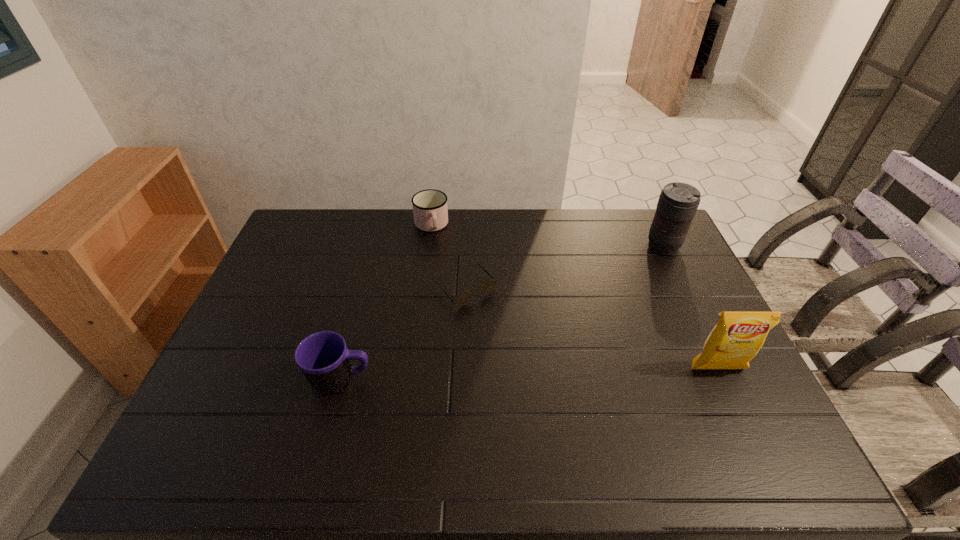
Find the location of a particular element. the left mug is located at coordinates (323, 357).

The image size is (960, 540). What are the coordinates of `the third shortest object` in the screenshot? It's located at coord(323,357).

Identify the location of crisp (potato chip). (738, 336).

I want to click on sunglasses, so click(x=487, y=286).

What are the coordinates of `the shortest object` in the screenshot? It's located at (487, 286).

Where is `telephoto lens`? The height and width of the screenshot is (540, 960). telephoto lens is located at coordinates (678, 202).

You are a GUI agent. You are given a task and a screenshot of the screen. Output one action in this format:
    pyautogui.click(x=<x>, y=<y>)
    Task: Click on the right mug
    
    Given the screenshot: What is the action you would take?
    pos(430,210)

Where is `the shorter mug`? The width and height of the screenshot is (960, 540). the shorter mug is located at coordinates (430, 210).

Locate an element on the screen. vacant space located 0.140m with the handle on the side of the left mug is located at coordinates (427, 380).

Identify the location of vacant area situated on the front of the crisp (potato chip) with the logo. Image resolution: width=960 pixels, height=540 pixels. (739, 415).